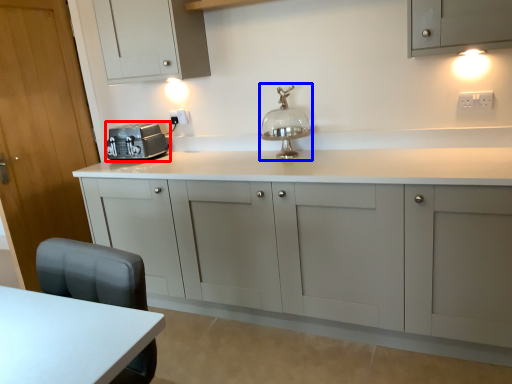
Question: Which point is further to the camera, home appliance (highlighted by a red box) or table lamp (highlighted by a blue box)?

Choices:
 (A) home appliance
 (B) table lamp

Answer: (A)